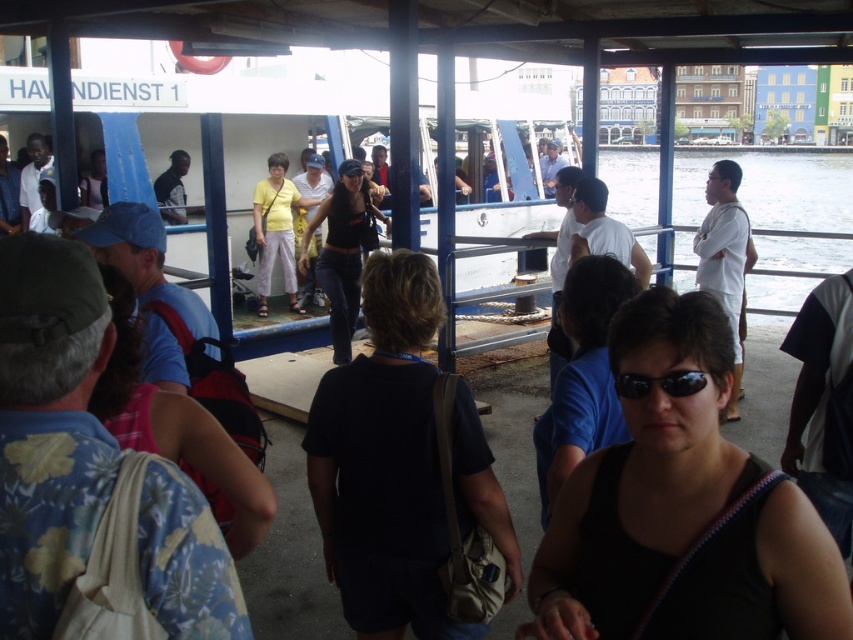
Measure the distance between black fabric sunglasses at center and black denim jeans at center.

black fabric sunglasses at center is 6.62 meters away from black denim jeans at center.

Is black fabric sunglasses at center shorter than black denim jeans at center?

Yes, black fabric sunglasses at center is shorter than black denim jeans at center.

Is point (666, 589) positioned before point (350, 227)?

Yes.

The height and width of the screenshot is (640, 853). I want to click on black fabric sunglasses at center, so click(x=682, y=512).

Is the position of yellow cotton shirt at center less distant than that of matte black shirt at upper left?

No, it is not.

Between yellow cotton shirt at center and matte black shirt at upper left, which one is positioned lower?

yellow cotton shirt at center is below.

Locate an element on the screen. This screenshot has height=640, width=853. yellow cotton shirt at center is located at coordinates (276, 228).

Who is positioned more to the right, floral shirt at left or black matte sunglasses at center?

black matte sunglasses at center

Between point (49, 509) and point (581, 417), which one is positioned behind?

The point (581, 417) is behind.

Locate an element on the screen. This screenshot has width=853, height=640. floral shirt at left is located at coordinates 48,426.